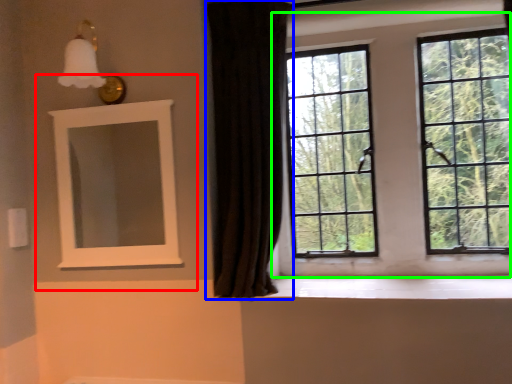
Question: Which object is positioned farthest from medicine cabinet (highlighted by a red box)? Select from curtain (highlighted by a blue box) and window (highlighted by a green box).

Choices:
 (A) curtain
 (B) window

Answer: (B)